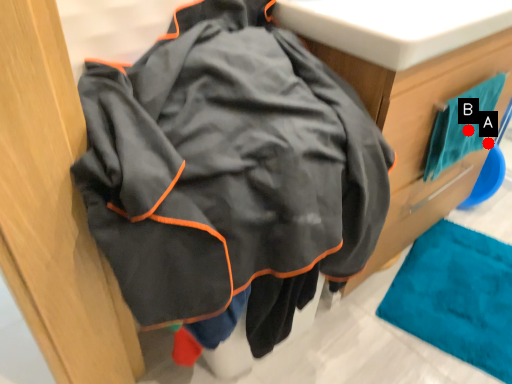
Question: Two points are circled on the image, labeled by A and B beside each circle. Which point is farther from the camera taking this photo?

Choices:
 (A) A is further
 (B) B is further

Answer: (A)